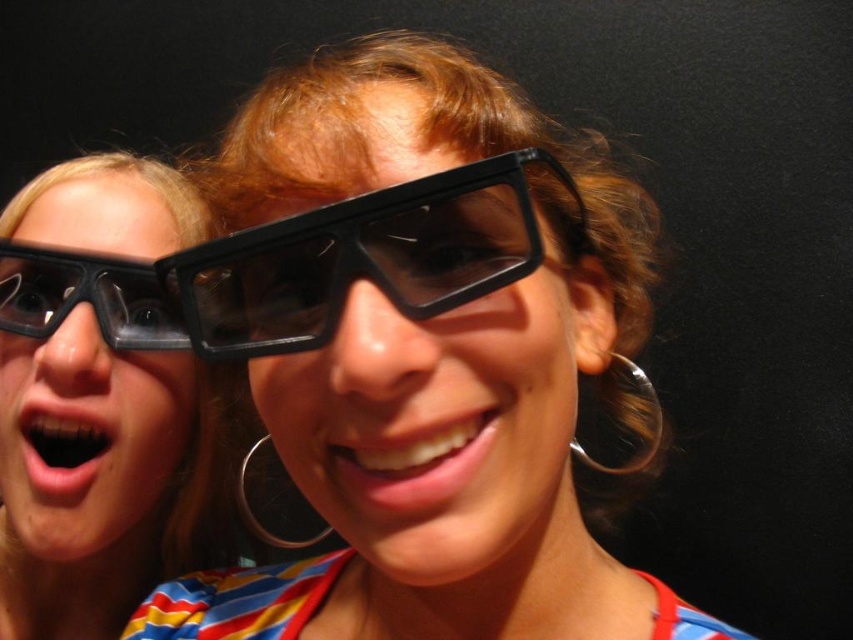
Question: From the image, what is the correct spatial relationship of matte black glasses at center in relation to transparent plastic goggles at left?

Choices:
 (A) left
 (B) right

Answer: (B)

Question: Which point is closer to the camera taking this photo?

Choices:
 (A) (656, 436)
 (B) (74, 346)
 (C) (54, 324)
 (D) (412, 472)

Answer: (D)

Question: From the image, what is the correct spatial relationship of black plastic goggles at center in relation to transparent plastic goggles at left?

Choices:
 (A) left
 (B) right

Answer: (B)

Question: Which point is farther to the camera?

Choices:
 (A) (624, 356)
 (B) (216, 269)
 (C) (20, 474)

Answer: (C)

Question: Which object is the closest to the matte black glasses at left?

Choices:
 (A) silver metallic hoop at right
 (B) matte black glasses at center

Answer: (B)

Question: Can you confirm if matte black glasses at center is smaller than black plastic goggles at center?

Choices:
 (A) yes
 (B) no

Answer: (B)